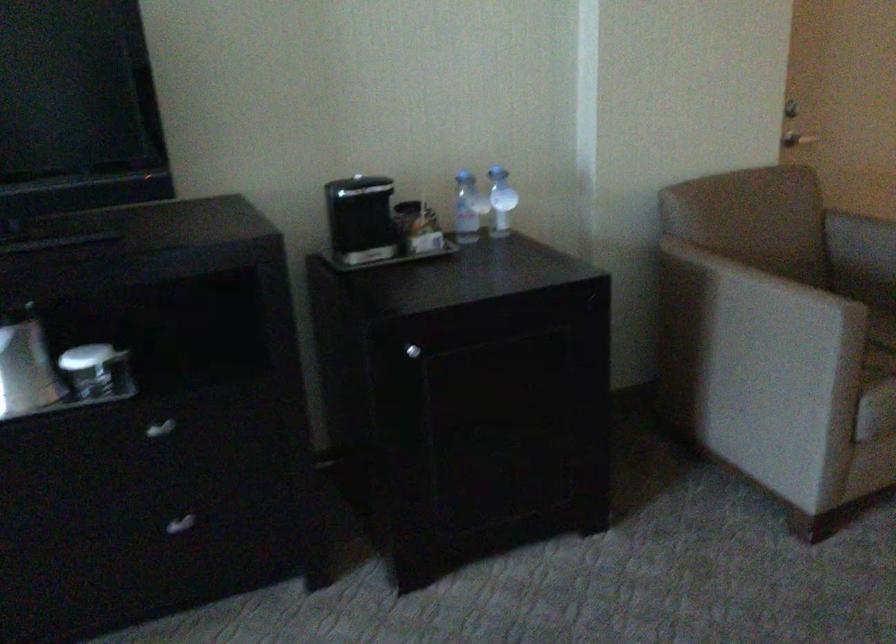
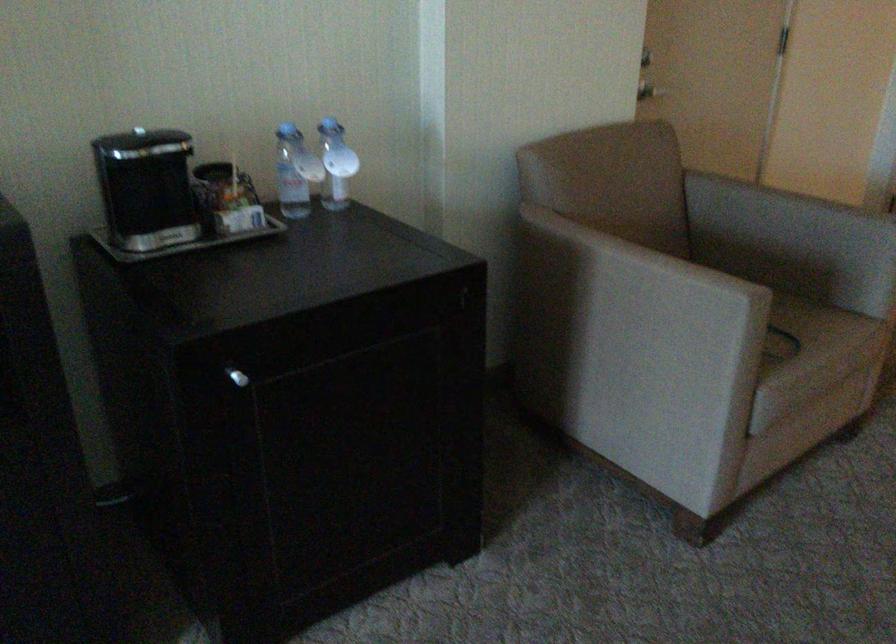
Where in the second image is the point corresponding to [469,205] from the first image?

(295, 172)